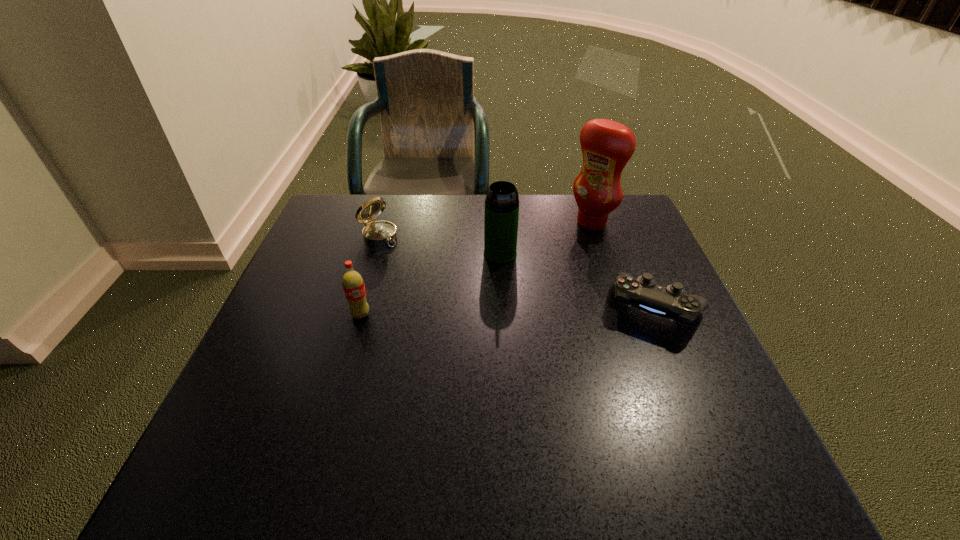
Identify the location of empty space between the second shortest object and the soda. (370, 275).

Locate which object is the second closest to the soda. Please provide its 2D coordinates. Your answer should be formatted as a tuple, i.e. [(x, y)], where the tuple contains the x and y coordinates of a point satisfying the conditions above.

[(501, 217)]

Locate which object ranks in proximity to the third tallest object. Please provide its 2D coordinates. Your answer should be formatted as a tuple, i.e. [(x, y)], where the tuple contains the x and y coordinates of a point satisfying the conditions above.

[(375, 233)]

Where is `free point that satisfies the following two spatial constraints: 1. on the front side of the compass; 2. on the right side of the third object from right to left`? Image resolution: width=960 pixels, height=540 pixels. free point that satisfies the following two spatial constraints: 1. on the front side of the compass; 2. on the right side of the third object from right to left is located at coordinates (373, 254).

Locate an element on the screen. The image size is (960, 540). free point that satisfies the following two spatial constraints: 1. on the front side of the third shortest object; 2. on the left side of the compass is located at coordinates (356, 315).